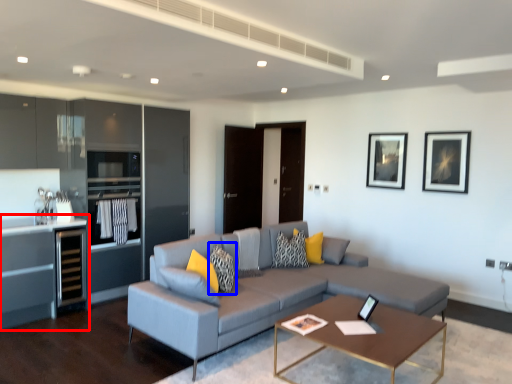
Question: Which object appears farthest to the camera in this image, cabinetry (highlighted by a red box) or pillow (highlighted by a blue box)?

Choices:
 (A) cabinetry
 (B) pillow

Answer: (A)